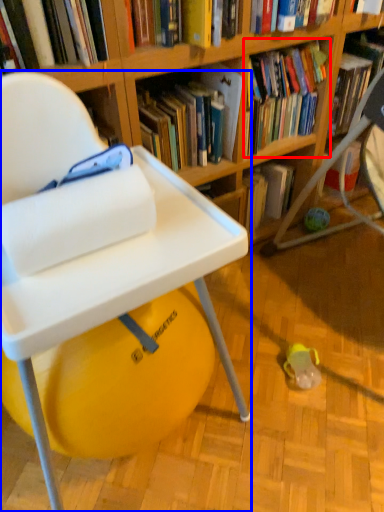
Question: Which of the following is the closest to the observer, book (highlighted by a red box) or chair (highlighted by a blue box)?

Choices:
 (A) book
 (B) chair

Answer: (B)